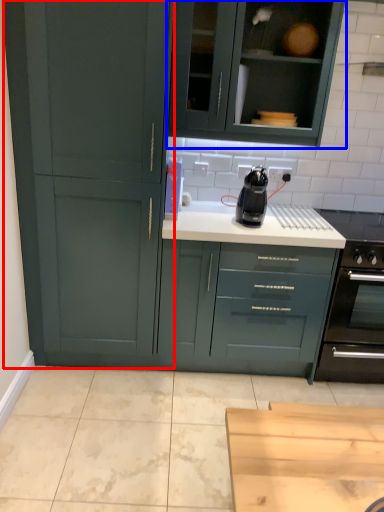
Question: Which of the following is the closest to the observer, cupboard (highlighted by a red box) or cabinetry (highlighted by a blue box)?

Choices:
 (A) cupboard
 (B) cabinetry

Answer: (A)